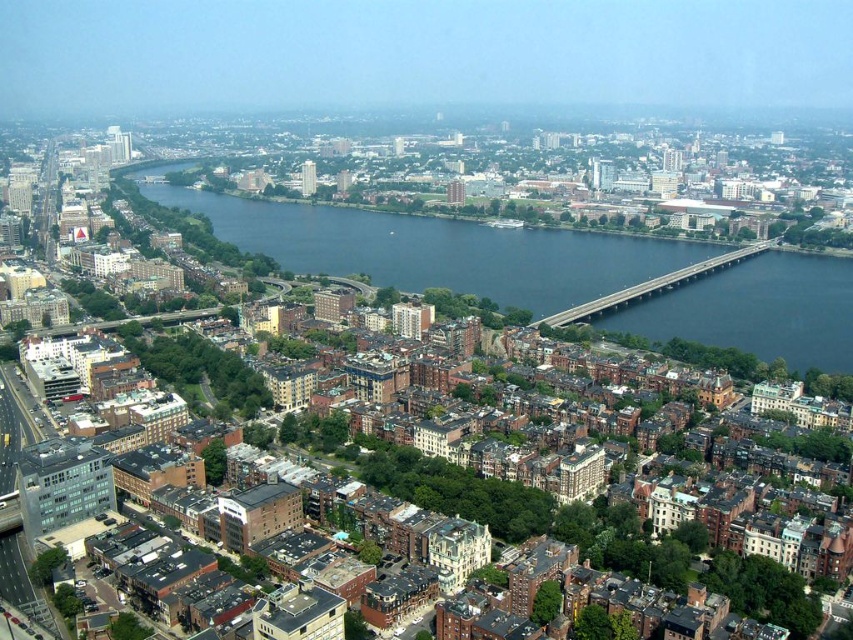
Is dark blue water at center to the left of concrete bridge at center from the viewer's perspective?

Indeed, dark blue water at center is positioned on the left side of concrete bridge at center.

Does dark blue water at center have a lesser height compared to concrete bridge at center?

In fact, dark blue water at center may be taller than concrete bridge at center.

What do you see at coordinates (433, 248) in the screenshot?
I see `dark blue water at center` at bounding box center [433, 248].

You are a GUI agent. You are given a task and a screenshot of the screen. Output one action in this format:
    pyautogui.click(x=<x>, y=<y>)
    Task: Click on the dark blue water at center
    
    Given the screenshot: What is the action you would take?
    pyautogui.click(x=433, y=248)